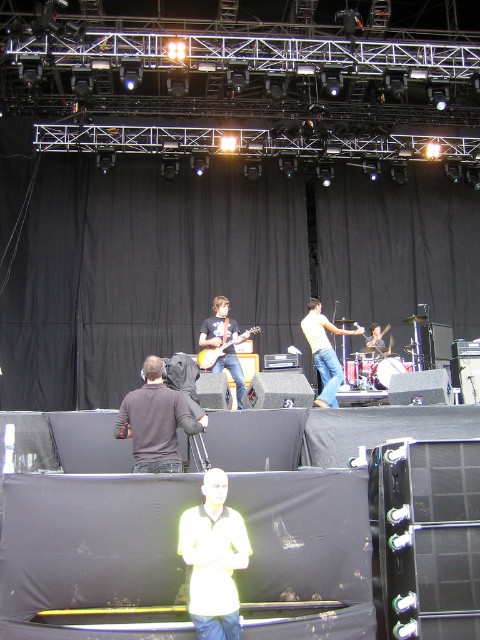
You are a photographer at the back of the stage. You want to take a photo of the white matte shirt at center and the light yellow shirt at center. Which one will be more visible in your photo?

The white matte shirt at center will be more visible in the photo because it is in front of the light yellow shirt at center, making it appear closer to the camera.

You are a photographer positioned at the back of the venue and want to capture both the white matte shirt at center and the light yellow shirt at center in a single photo. Given that your camera has a maximum focus range of 5 meters, can you ensure both subjects are in focus without moving closer?

The white matte shirt at center and light yellow shirt at center are 4.34 meters apart from each other. Since the distance between them is within the camera maximum focus range of 5 meters, both subjects can be in focus in a single photo without moving closer.

You are standing at the back of the concert venue and want to determine which of the two points, point [317,396] or point [197,362], is closer to you. Based on the spatial arrangement, which point is nearer?

Point [317,396] is further to the viewer than point [197,362], so the closer point to you is point [197,362].